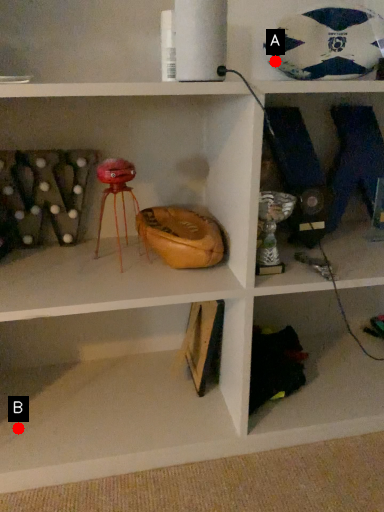
Question: Two points are circled on the image, labeled by A and B beside each circle. Which point is further to the camera?

Choices:
 (A) A is further
 (B) B is further

Answer: (B)